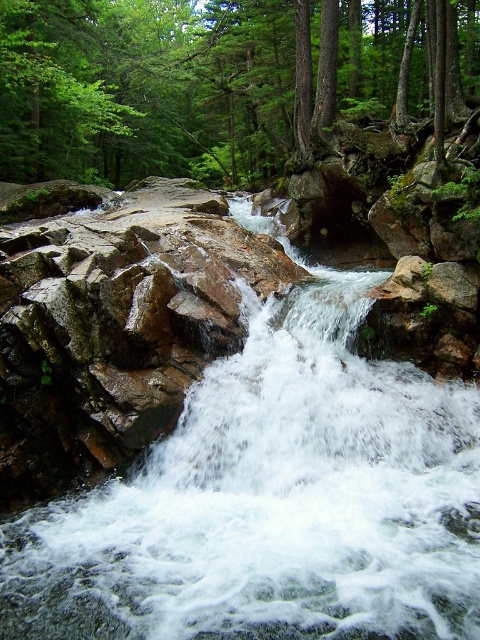
Question: Can you confirm if white frothy water at center is thinner than green matte tree at center?

Choices:
 (A) no
 (B) yes

Answer: (B)

Question: Which object is closer to the camera taking this photo?

Choices:
 (A) green matte tree at center
 (B) white frothy water at center

Answer: (B)

Question: Does white frothy water at center have a smaller size compared to green matte tree at center?

Choices:
 (A) yes
 (B) no

Answer: (A)

Question: Which point is closer to the camera taking this photo?

Choices:
 (A) (51, 42)
 (B) (7, 529)

Answer: (B)

Question: Where is white frothy water at center located in relation to green matte tree at center in the image?

Choices:
 (A) left
 (B) right

Answer: (B)